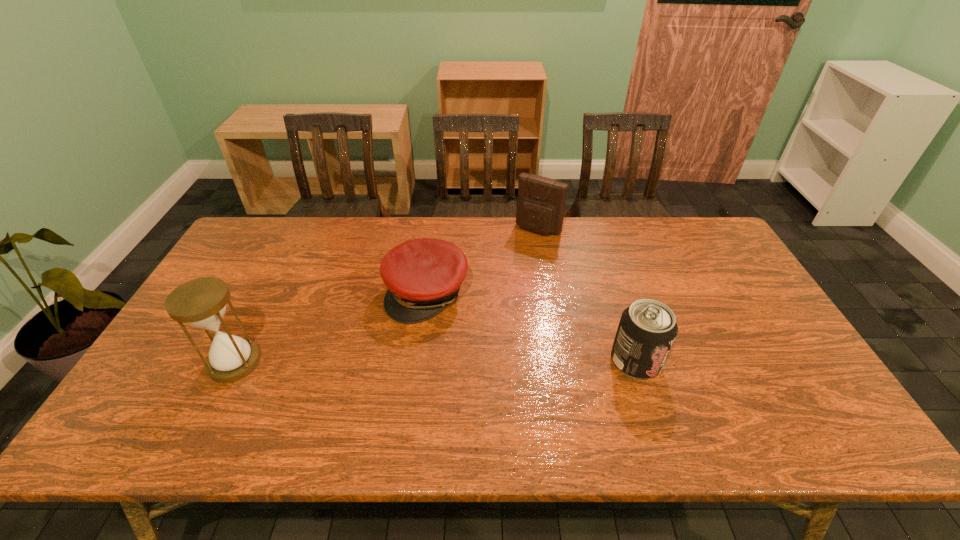
Locate an element on the screen. the leftmost object is located at coordinates (201, 302).

Where is `hourglass`? hourglass is located at coordinates (201, 302).

Image resolution: width=960 pixels, height=540 pixels. I want to click on the rightmost object, so click(647, 329).

Where is `soda can`? The image size is (960, 540). soda can is located at coordinates (647, 329).

Identify the location of pouch. The height and width of the screenshot is (540, 960). (541, 202).

Identify the location of the farthest object. (541, 202).

Where is `cap`? cap is located at coordinates (423, 276).

You are a GUI agent. You are given a task and a screenshot of the screen. Output one action in this format:
    pyautogui.click(x=<x>, y=<y>)
    Task: Click on the shortest object
    Image resolution: width=960 pixels, height=540 pixels.
    Given the screenshot: What is the action you would take?
    pyautogui.click(x=423, y=276)

This screenshot has height=540, width=960. I want to click on vacant space located 0.200m on the back of the tallest object, so click(x=271, y=291).

The height and width of the screenshot is (540, 960). What are the coordinates of `vacant area situated 0.280m on the back of the soda can` in the screenshot? It's located at (607, 272).